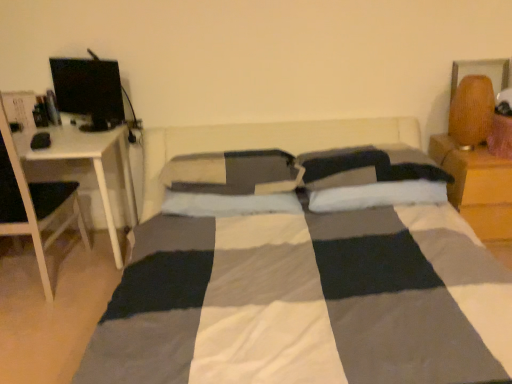
Question: Is wooden nightstand at right far from matte black monitor at upper left?

Choices:
 (A) yes
 (B) no

Answer: (A)

Question: Is wooden nightstand at right at the right side of matte black monitor at upper left?

Choices:
 (A) no
 (B) yes

Answer: (B)

Question: Does wooden nightstand at right have a greater width compared to matte black monitor at upper left?

Choices:
 (A) no
 (B) yes

Answer: (B)

Question: Considering the relative sizes of wooden nightstand at right and matte black monitor at upper left in the image provided, is wooden nightstand at right thinner than matte black monitor at upper left?

Choices:
 (A) no
 (B) yes

Answer: (A)

Question: Is wooden nightstand at right positioned beyond the bounds of matte black monitor at upper left?

Choices:
 (A) no
 (B) yes

Answer: (B)

Question: From the image's perspective, is wooden nightstand at right located above or below braided wood table lamp at upper right?

Choices:
 (A) below
 (B) above

Answer: (A)

Question: Is wooden nightstand at right in front of or behind braided wood table lamp at upper right in the image?

Choices:
 (A) front
 (B) behind

Answer: (B)

Question: Based on their sizes in the image, would you say wooden nightstand at right is bigger or smaller than braided wood table lamp at upper right?

Choices:
 (A) small
 (B) big

Answer: (B)

Question: From their relative heights in the image, would you say wooden nightstand at right is taller or shorter than braided wood table lamp at upper right?

Choices:
 (A) tall
 (B) short

Answer: (A)

Question: Looking at the image, does white soft pillow at center, the second pillow in the right-to-left sequence, seem bigger or smaller compared to wooden nightstand at right?

Choices:
 (A) small
 (B) big

Answer: (A)

Question: Which is correct: white soft pillow at center, which is counted as the 2th pillow, starting from the left, is inside wooden nightstand at right, or outside of it?

Choices:
 (A) inside
 (B) outside

Answer: (B)

Question: In terms of height, does white soft pillow at center, the second pillow in the right-to-left sequence, look taller or shorter compared to wooden nightstand at right?

Choices:
 (A) short
 (B) tall

Answer: (A)

Question: Relative to wooden nightstand at right, is white soft pillow at center, which is counted as the 2th pillow, starting from the left, in front or behind?

Choices:
 (A) front
 (B) behind

Answer: (A)

Question: Considering the positions of matte black monitor at upper left and white soft pillow at center, which is counted as the 2th pillow, starting from the left, in the image, is matte black monitor at upper left bigger or smaller than white soft pillow at center, which is counted as the 2th pillow, starting from the left,?

Choices:
 (A) small
 (B) big

Answer: (A)

Question: Would you say matte black monitor at upper left is to the left or to the right of white soft pillow at center, which is counted as the 2th pillow, starting from the left, in the picture?

Choices:
 (A) right
 (B) left

Answer: (B)